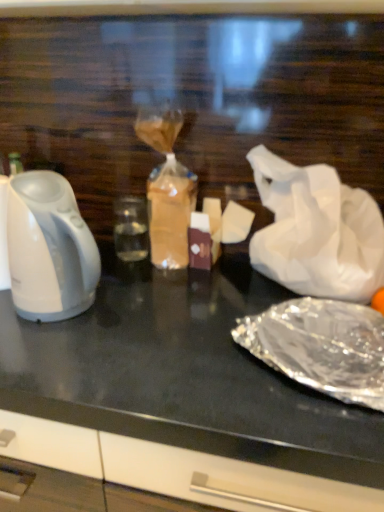
The width and height of the screenshot is (384, 512). Find the location of `free point above black glossy table at center (from a real-world perspective)`. free point above black glossy table at center (from a real-world perspective) is located at coordinates (199, 320).